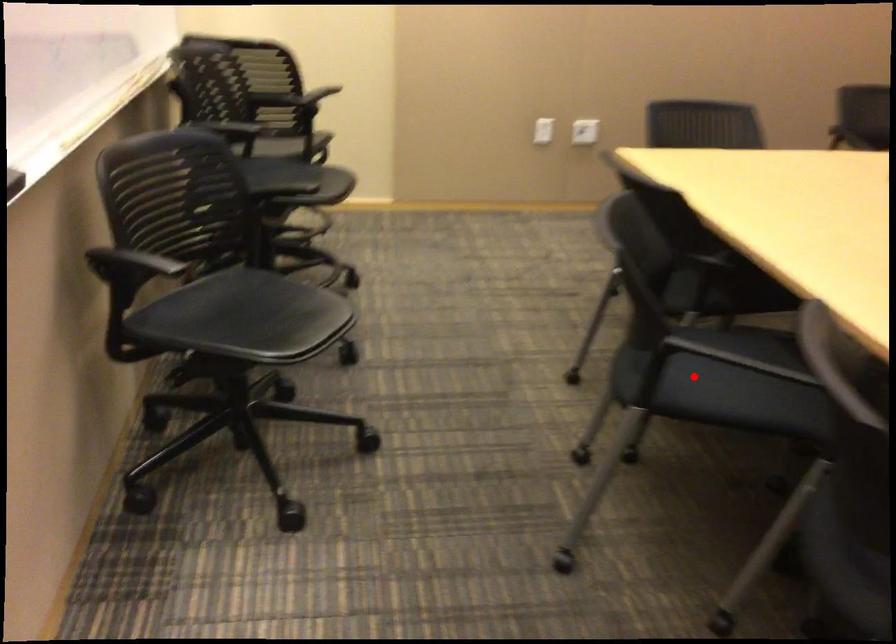
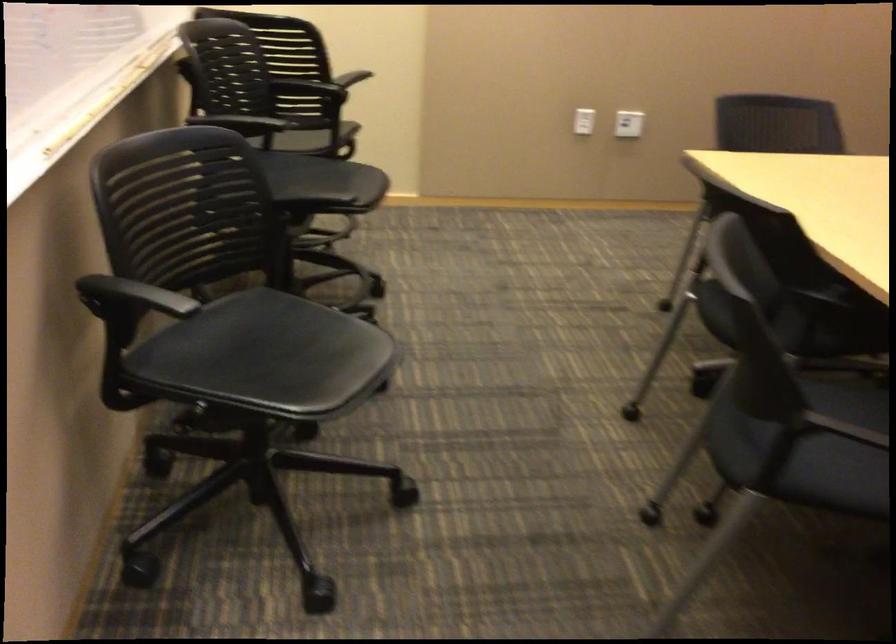
Question: I am providing you with two images of the same scene from different viewpoints. Image1 has a red point marked. In image2, the corresponding 3D location appears at what relative position? Reply with the corresponding letter.

Choices:
 (A) Closer
 (B) Farther

Answer: (A)